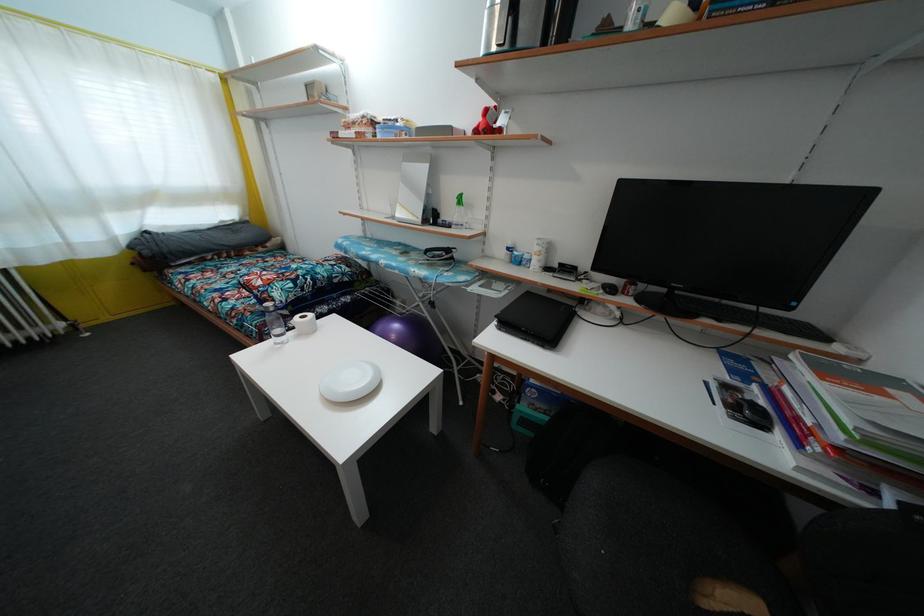
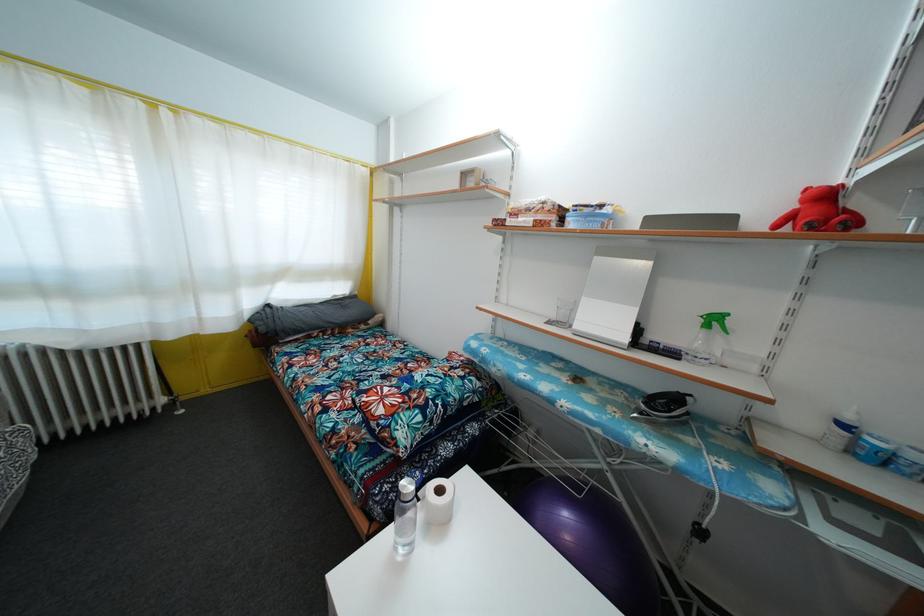
Locate, in the second image, the point that corresponds to (358,130) in the first image.

(531, 216)